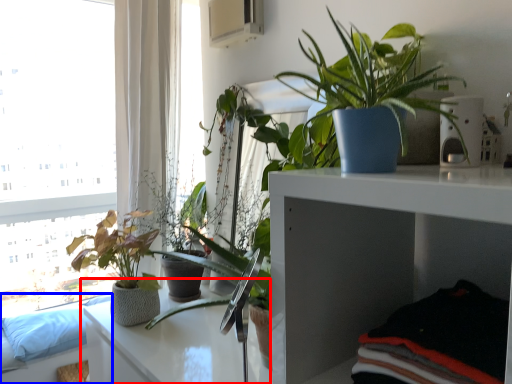
Question: Among these objects, which one is farthest to the camera, table (highlighted by a red box) or couch (highlighted by a blue box)?

Choices:
 (A) table
 (B) couch

Answer: (B)